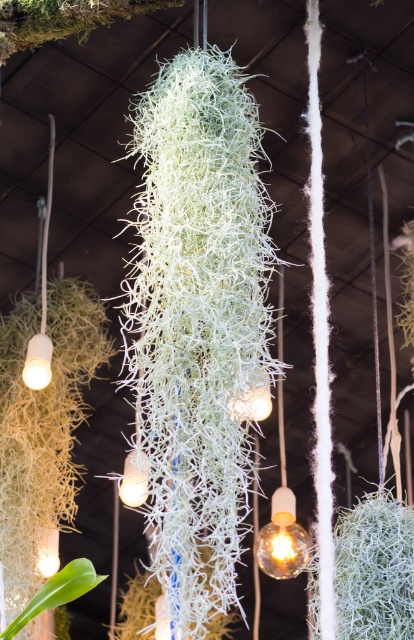
Can you confirm if white fibrous plant at center is positioned above green fibrous plant at center?

Correct, white fibrous plant at center is located above green fibrous plant at center.

The height and width of the screenshot is (640, 414). What do you see at coordinates (197, 323) in the screenshot?
I see `white fibrous plant at center` at bounding box center [197, 323].

Where is `white fibrous plant at center`? white fibrous plant at center is located at coordinates (197, 323).

Is green fibrous plant at center behind green leafy plant at lower left?

Yes, it is behind green leafy plant at lower left.

Between point (382, 556) and point (33, 616), which one is positioned behind?

The point (382, 556) is more distant.

This screenshot has height=640, width=414. Describe the element at coordinates (375, 570) in the screenshot. I see `green fibrous plant at center` at that location.

Locate an element on the screen. The image size is (414, 640). green fibrous plant at center is located at coordinates (375, 570).

Can you confirm if white fibrous plant at center is taller than green leafy plant at lower left?

Yes, white fibrous plant at center is taller than green leafy plant at lower left.

Can you confirm if white fibrous plant at center is wider than green leafy plant at lower left?

Indeed, white fibrous plant at center has a greater width compared to green leafy plant at lower left.

Who is more distant from viewer, (233,241) or (81,572)?

Positioned behind is point (233,241).

Locate an element on the screen. white fibrous plant at center is located at coordinates (197, 323).